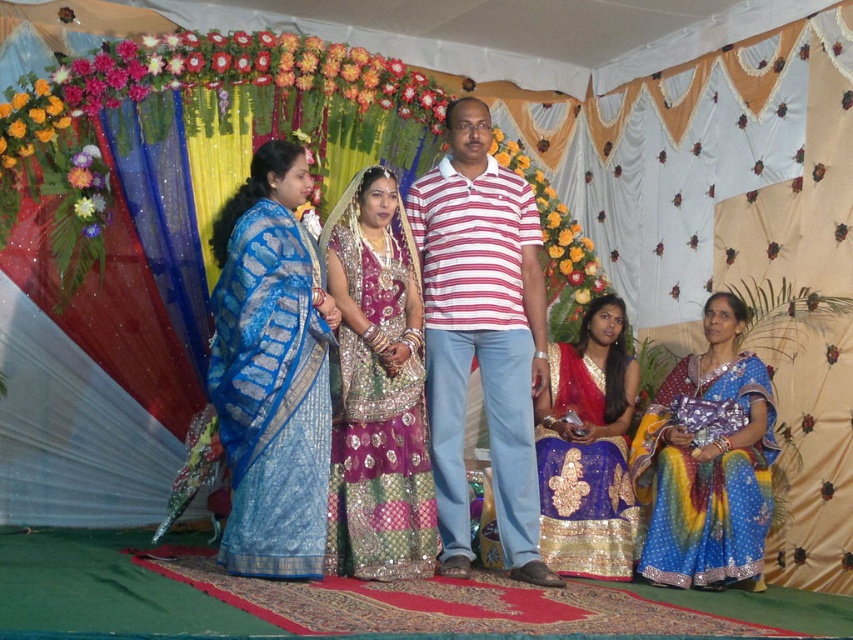
Looking at this image, who is taller, striped cotton polo shirt at center or shiny silk saree at center?

shiny silk saree at center

Does striped cotton polo shirt at center have a greater width compared to shiny silk saree at center?

Yes.

Consider the image. Measure the distance between striped cotton polo shirt at center and camera.

They are 5.12 meters apart.

Locate an element on the screen. striped cotton polo shirt at center is located at coordinates (480, 336).

Does shiny silk saree at center have a greater height compared to shiny blue sari at lower right?

Correct, shiny silk saree at center is much taller as shiny blue sari at lower right.

Who is positioned more to the left, shiny silk saree at center or shiny blue sari at lower right?

From the viewer's perspective, shiny silk saree at center appears more on the left side.

What do you see at coordinates (476, 323) in the screenshot? The image size is (853, 640). I see `shiny silk saree at center` at bounding box center [476, 323].

What are the coordinates of `shiny silk saree at center` in the screenshot? It's located at (476, 323).

Is point (465, 484) in front of point (357, 280)?

That is False.

In the scene shown: Can you confirm if striped cotton polo shirt at center is shorter than sparkling sequin saree at center?

Incorrect, striped cotton polo shirt at center's height does not fall short of sparkling sequin saree at center's.

Is point (448, 449) positioned after point (407, 376)?

Yes, it is.

Find the location of a particular element. The height and width of the screenshot is (640, 853). striped cotton polo shirt at center is located at coordinates (480, 336).